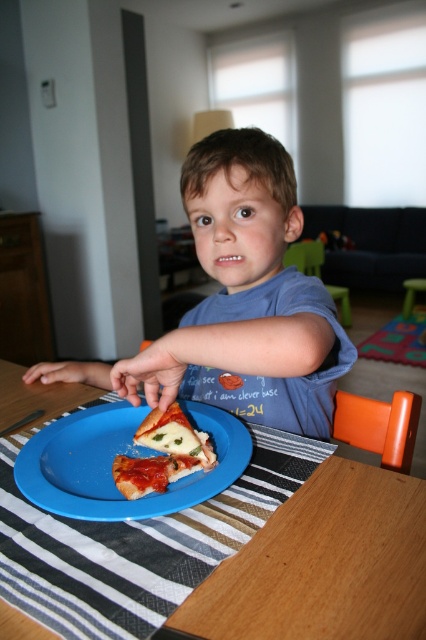
You are a photographer taking a picture of the blue cotton shirt at center and the golden brown crusty pizza at center. Based on their positions, which object is closer to the right edge of the image?

The blue cotton shirt at center is to the right of the golden brown crusty pizza at center, so it is closer to the right edge of the image.

A child is sitting at a table wearing a blue cotton shirt at center and has a blue plastic plate at center in front of them. The child wants to grab the plate with their hand. Can they reach it without moving their body?

The distance between the blue cotton shirt at center and the blue plastic plate at center is 16.77 centimeters. Since the shirt is on the child and the plate is at the center, the child can easily reach the plate with their hand without moving their body.

You are a photographer setting up a shoot. You have to ensure that the blue cotton shirt at center and the blue plastic plate at center are both in frame. Given that your camera has a fixed focus that can only capture objects up to 1 meter tall, will both items be in focus?

The blue cotton shirt at center is taller than the blue plastic plate at center. Since the camera can only focus on objects up to 1 meter tall, both items will be in focus only if the blue cotton shirt at center is under 1 meter. However, without specific height measurements, we cannot confirm. The description only states the shirt is taller than the plate, but not their absolute heights.